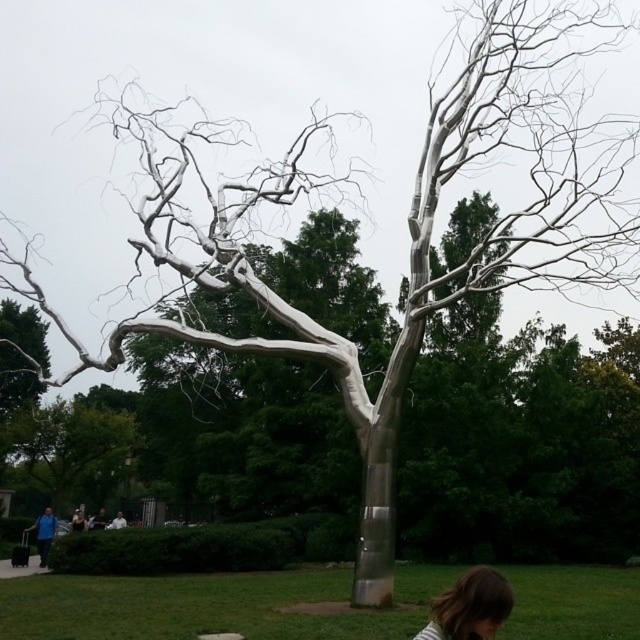
Is silver metallic tree at center positioned behind white matte shirt at lower center?

No, silver metallic tree at center is closer to the viewer.

Can you confirm if silver metallic tree at center is smaller than white matte shirt at lower center?

No, silver metallic tree at center is not smaller than white matte shirt at lower center.

Is point (164, 604) behind point (113, 525)?

No, it is in front of (113, 525).

Locate an element on the screen. The image size is (640, 640). silver metallic tree at center is located at coordinates (211, 604).

Does silver metallic tree at center have a greater width compared to blue fabric person at lower left?

Indeed, silver metallic tree at center has a greater width compared to blue fabric person at lower left.

Does point (449, 582) come behind point (38, 538)?

That is False.

This screenshot has width=640, height=640. What are the coordinates of `silver metallic tree at center` in the screenshot? It's located at (211, 604).

Looking at this image, can you confirm if dark brown hair at lower right is positioned below blue fabric person at lower left?

No, dark brown hair at lower right is not below blue fabric person at lower left.

Between point (432, 627) and point (48, 513), which one is positioned in front?

Point (432, 627)

At what (x,y) coordinates should I click in order to perform the action: click on dark brown hair at lower right. Please return your answer as a coordinate pair (x, y). The width and height of the screenshot is (640, 640). Looking at the image, I should click on (468, 605).